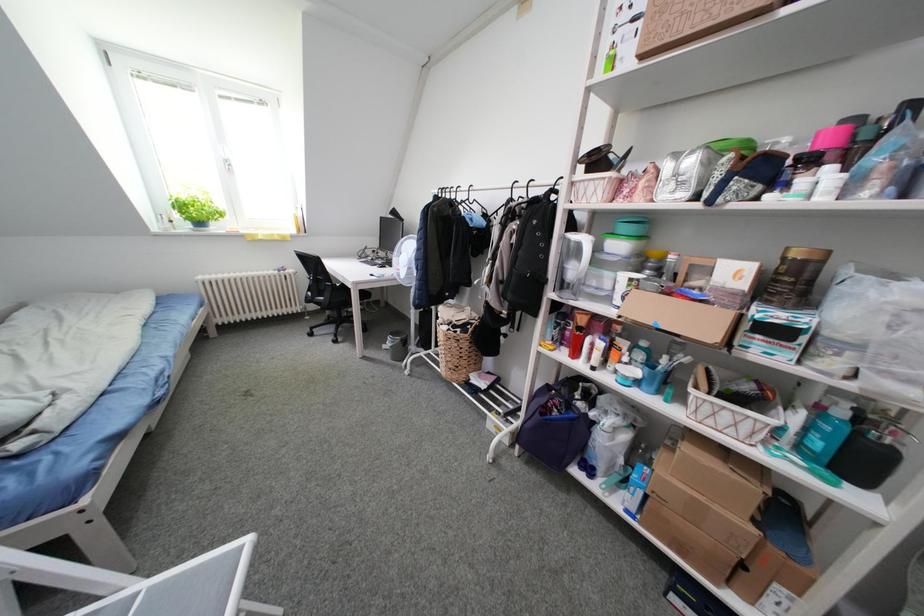
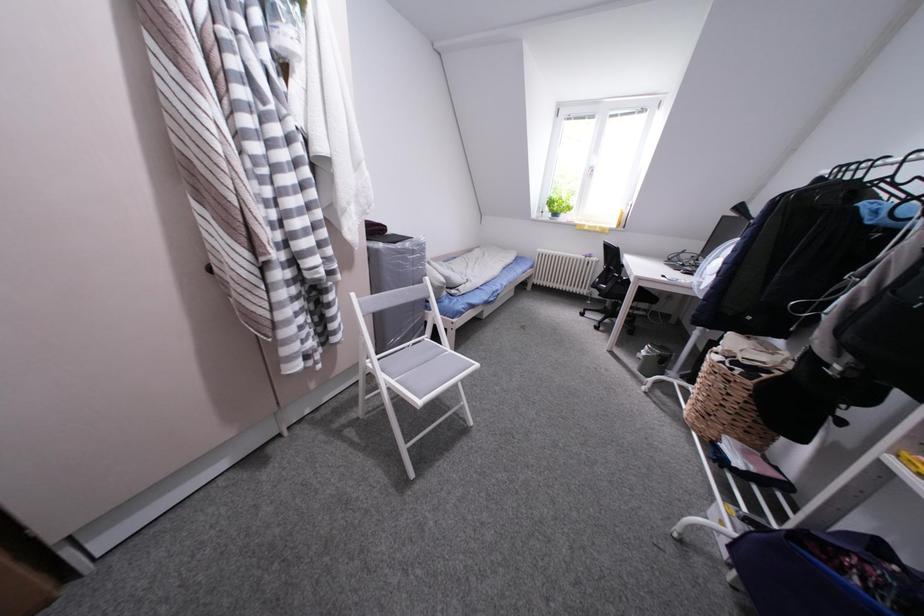
Question: The camera is either moving clockwise (left) or counter-clockwise (right) around the object. The first image is from the beginning of the video and the second image is from the end. Is the camera moving left or right when shooting the video?

Choices:
 (A) Left
 (B) Right

Answer: (B)